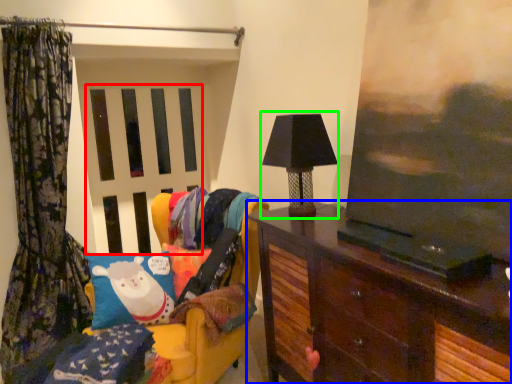
Question: Considering the real-world distances, which object is farthest from screen door (highlighted by a red box)? furniture (highlighted by a blue box) or table lamp (highlighted by a green box)?

Choices:
 (A) furniture
 (B) table lamp

Answer: (A)